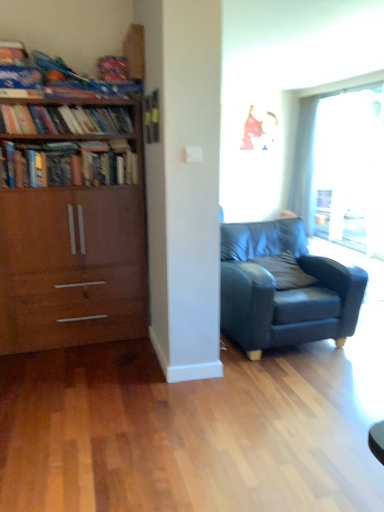
Question: Could you tell me if hardcover books at left, which appears as the second book when viewed from the top, is turned towards gray fabric pillow at center?

Choices:
 (A) yes
 (B) no

Answer: (B)

Question: From the image's perspective, would you say hardcover books at left, which appears as the second book when viewed from the top, is shown under gray fabric pillow at center?

Choices:
 (A) no
 (B) yes

Answer: (A)

Question: Is hardcover books at left, which appears as the second book when viewed from the top, closer to camera compared to gray fabric pillow at center?

Choices:
 (A) yes
 (B) no

Answer: (A)

Question: Is hardcover books at left, the first book when ordered from bottom to top, bigger than gray fabric pillow at center?

Choices:
 (A) no
 (B) yes

Answer: (B)

Question: Is gray fabric pillow at center completely or partially inside hardcover books at left, which appears as the second book when viewed from the top?

Choices:
 (A) no
 (B) yes

Answer: (A)

Question: From a real-world perspective, relative to wooden bookcase at left, is wooden bookshelf at left, the second book from the bottom, vertically above or below?

Choices:
 (A) above
 (B) below

Answer: (A)

Question: Which is correct: wooden bookshelf at left, the first book from the top, is inside wooden bookcase at left, or outside of it?

Choices:
 (A) inside
 (B) outside

Answer: (A)

Question: Is wooden bookshelf at left, the second book from the bottom, in front of or behind wooden bookcase at left in the image?

Choices:
 (A) front
 (B) behind

Answer: (B)

Question: Is wooden bookshelf at left, the second book from the bottom, wider or thinner than wooden bookcase at left?

Choices:
 (A) wide
 (B) thin

Answer: (B)

Question: Is point (51, 128) closer or farther from the camera than point (82, 183)?

Choices:
 (A) farther
 (B) closer

Answer: (B)

Question: Looking at their shapes, would you say wooden bookshelf at left, the second book from the bottom, is wider or thinner than hardcover books at left, the first book when ordered from bottom to top?

Choices:
 (A) thin
 (B) wide

Answer: (A)

Question: From their relative heights in the image, would you say wooden bookshelf at left, the first book from the top, is taller or shorter than hardcover books at left, which appears as the second book when viewed from the top?

Choices:
 (A) tall
 (B) short

Answer: (B)

Question: Considering their positions, is wooden bookshelf at left, the first book from the top, located in front of or behind hardcover books at left, the first book when ordered from bottom to top?

Choices:
 (A) front
 (B) behind

Answer: (B)

Question: From the image's perspective, is white sheer curtain at upper right located above or below transparent glass window at upper right?

Choices:
 (A) above
 (B) below

Answer: (A)

Question: Is white sheer curtain at upper right inside or outside of transparent glass window at upper right?

Choices:
 (A) inside
 (B) outside

Answer: (B)